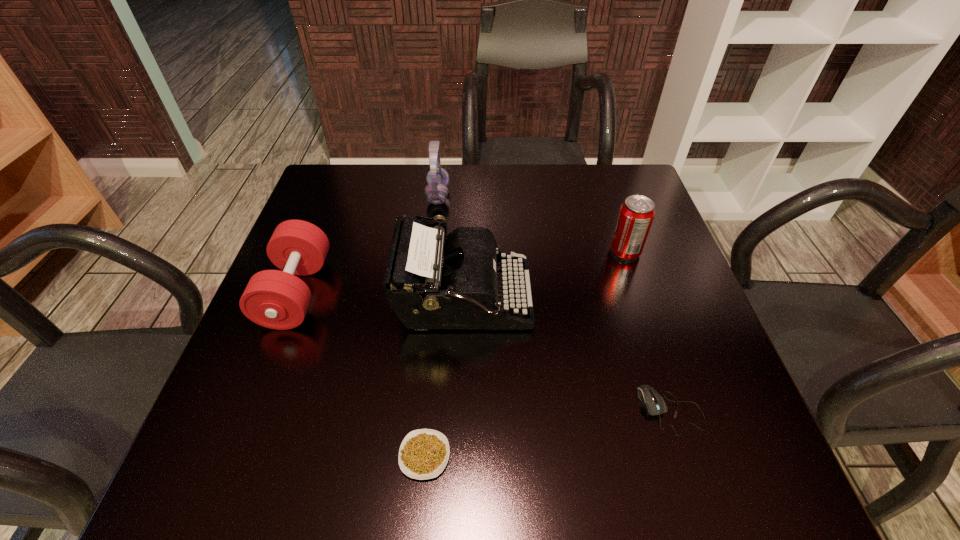
Identify the location of vacant space at the left edge. The image size is (960, 540). (279, 393).

In order to click on vacant area at the right edge in this screenshot , I will do `click(614, 268)`.

Where is `free region at the far left corner`? The image size is (960, 540). free region at the far left corner is located at coordinates (350, 174).

Find the location of a particular element. The image size is (960, 540). vacant space at the far right corner is located at coordinates (605, 203).

The image size is (960, 540). What are the coordinates of `vacant space at the near right corner` in the screenshot? It's located at (696, 486).

Find the location of a particular element. This screenshot has width=960, height=540. free area in between the typewriter and the second shortest object is located at coordinates (567, 355).

Where is `vacant area that lies between the headset and the dumbbell`? This screenshot has height=540, width=960. vacant area that lies between the headset and the dumbbell is located at coordinates (368, 244).

Identify the location of free point between the typewriter and the legume. Image resolution: width=960 pixels, height=540 pixels. (444, 377).

At what (x,y) coordinates should I click in order to perform the action: click on vacant point located between the legume and the leftmost object. Please return your answer as a coordinate pair (x, y). This screenshot has width=960, height=540. Looking at the image, I should click on (361, 374).

The image size is (960, 540). Identify the location of free spot between the typewriter and the soda. (544, 275).